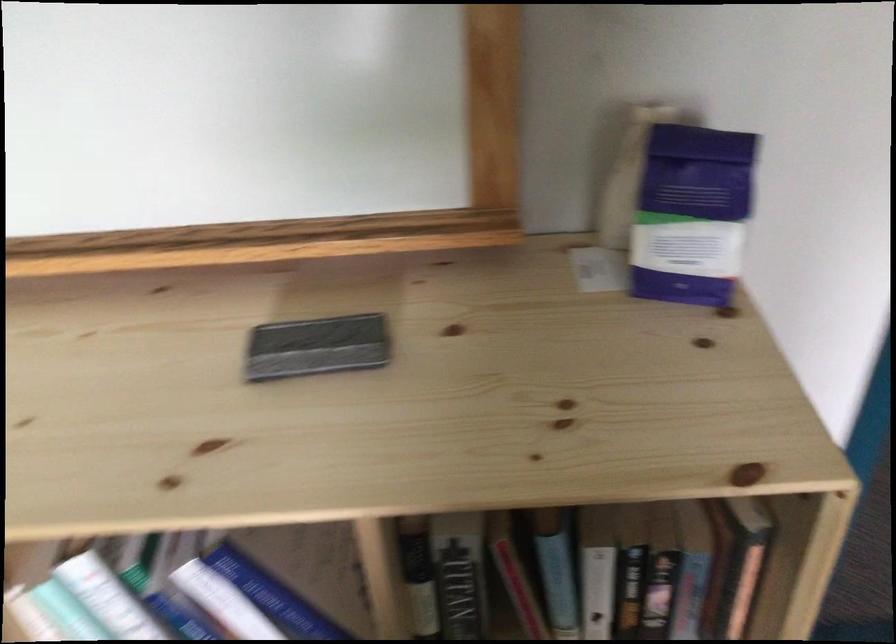
This screenshot has width=896, height=644. I want to click on purple paper bag, so click(x=692, y=214).